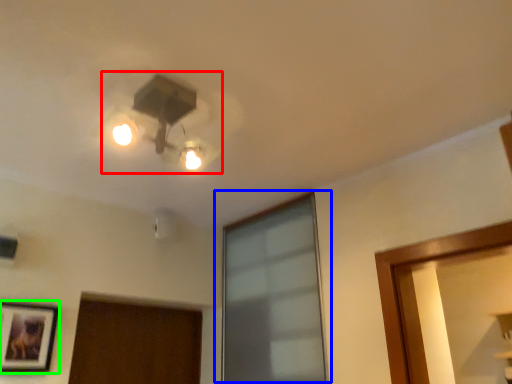
Question: Estimate the real-world distances between objects in this image. Which object is closer to lamp (highlighted by a red box), window (highlighted by a blue box) or picture frame (highlighted by a green box)?

Choices:
 (A) window
 (B) picture frame

Answer: (A)